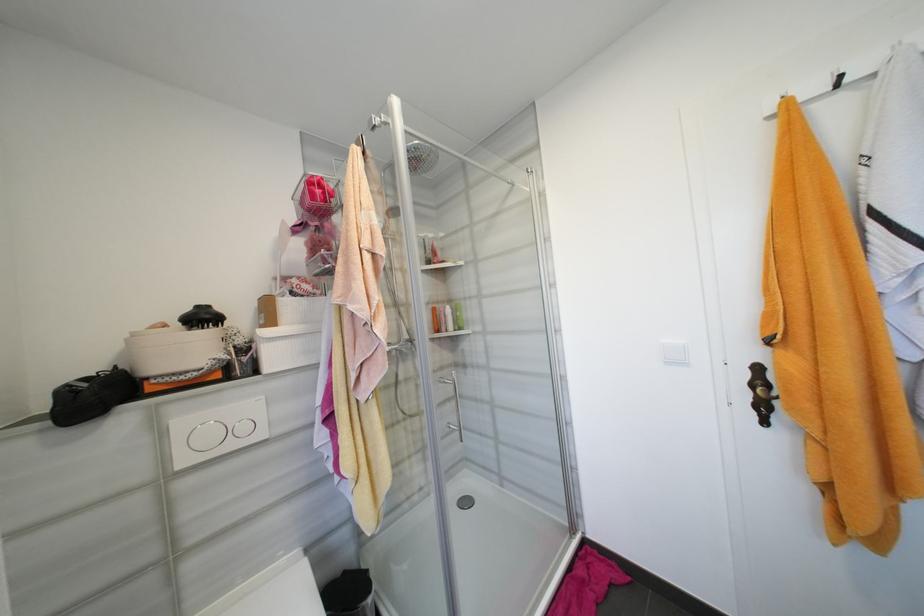
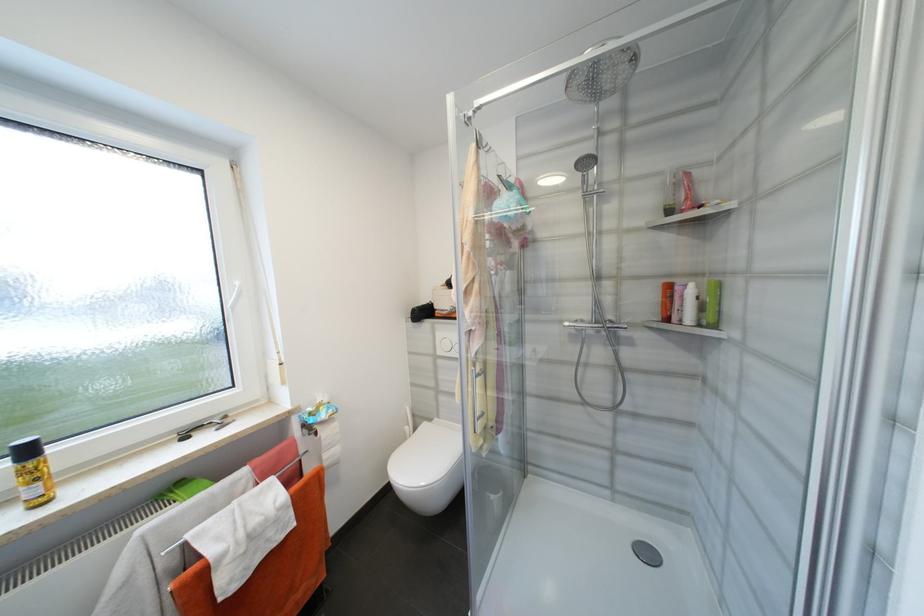
Find the pixel in the second image that matches the point at 151,477 in the first image.

(436, 352)